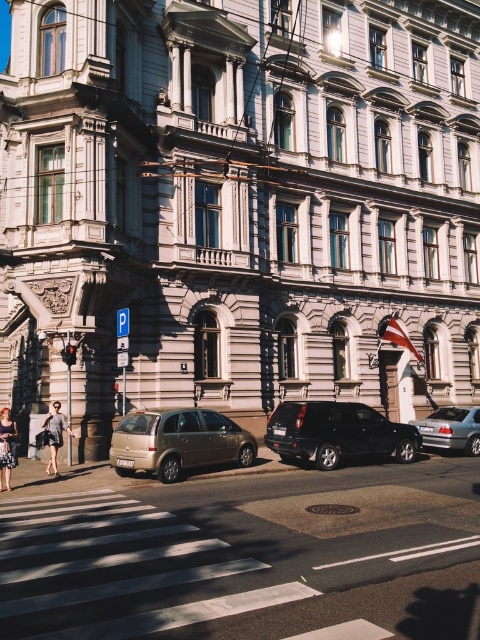
Is matte black dress at lower left thinner than light gray fabric coat at lower left?

In fact, matte black dress at lower left might be wider than light gray fabric coat at lower left.

Between matte black dress at lower left and light gray fabric coat at lower left, which one appears on the left side from the viewer's perspective?

From the viewer's perspective, matte black dress at lower left appears more on the left side.

The image size is (480, 640). Find the location of `matte black dress at lower left`. matte black dress at lower left is located at coordinates (7, 448).

Find the location of a particular element. The width and height of the screenshot is (480, 640). matte black dress at lower left is located at coordinates (7, 448).

Is point (292, 420) positioned before point (7, 424)?

No, (292, 420) is further to viewer.

Does point (336, 460) come farther from viewer compared to point (12, 428)?

Yes.

Which is behind, point (317, 458) or point (2, 433)?

The point (317, 458) is behind.

The image size is (480, 640). I want to click on shiny black suv at center, so click(336, 433).

Who is more forward, (415,572) or (377,449)?

Point (415,572) is in front.

Which is in front, point (97, 620) or point (310, 429)?

Point (97, 620)

You are a GUI agent. You are given a task and a screenshot of the screen. Output one action in this format:
    pyautogui.click(x=<x>, y=<y>)
    Task: Click on the white asphalt at center
    This screenshot has width=480, height=640.
    Given the screenshot: What is the action you would take?
    pyautogui.click(x=243, y=554)